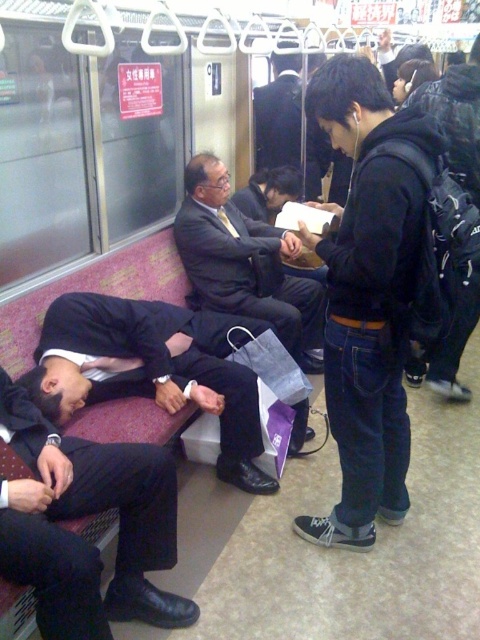
You are a passenger on a train and need to place a 12 inch briefcase between the dark blue suit at center and the matte black suit at center. Is there enough space?

The dark blue suit at center is 22.91 inches away from matte black suit at center. Since the briefcase is 12 inches wide, there is enough space to place it between them.

You are a passenger in a subway car and need to know if the black suit at lower left has more space than the matte black suit at center. Can you determine this based on their positions?

The black suit at lower left occupies less space than the matte black suit at center, so the matte black suit at center has more space.

You are a tailor measuring suits for alterations. You have two suits to measure in the subway car scene. The first is the black suit at lower left and the second is the matte black suit at center. Which of these two suits has a smaller width?

The black suit at lower left has a smaller width than the matte black suit at center.